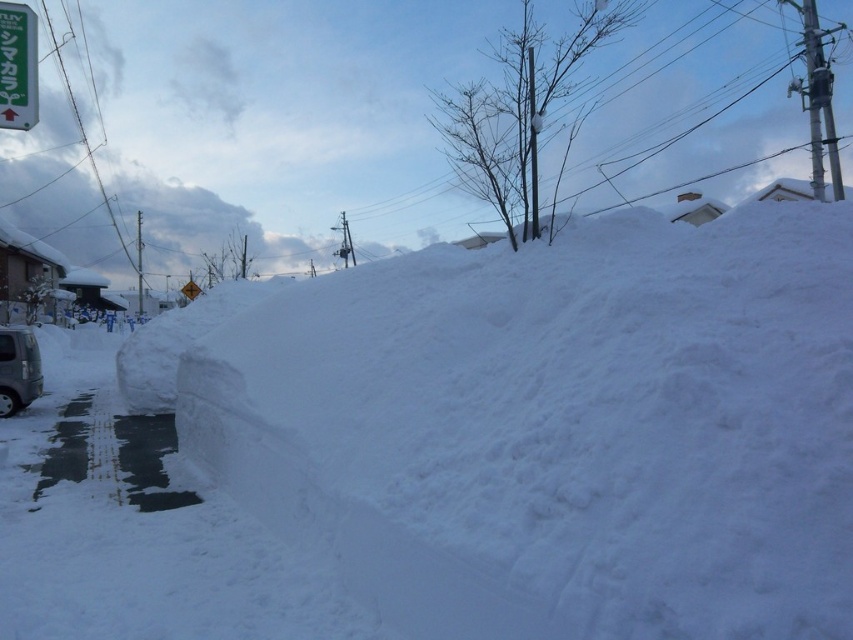
Which of these two, metallic silver car at lower left or metallic green sign at upper left, stands taller?

With more height is metallic green sign at upper left.

Can you confirm if metallic silver car at lower left is smaller than metallic green sign at upper left?

Indeed, metallic silver car at lower left has a smaller size compared to metallic green sign at upper left.

Between point (25, 371) and point (189, 296), which one is positioned in front?

Positioned in front is point (25, 371).

The width and height of the screenshot is (853, 640). What are the coordinates of `metallic silver car at lower left` in the screenshot? It's located at (18, 369).

Between white fluffy snow at center and metallic silver car at lower left, which one appears on the right side from the viewer's perspective?

From the viewer's perspective, white fluffy snow at center appears more on the right side.

Is white fluffy snow at center smaller than metallic silver car at lower left?

Yes.

Who is more forward, (659, 604) or (0, 344)?

Point (659, 604)

Where is `white fluffy snow at center`? The width and height of the screenshot is (853, 640). white fluffy snow at center is located at coordinates (560, 428).

I want to click on green plastic sign at upper left, so click(16, 67).

Which is in front, point (10, 51) or point (15, 337)?

Point (10, 51) is more forward.

Is point (1, 38) more distant than point (1, 381)?

No.

Identify the location of green plastic sign at upper left. (16, 67).